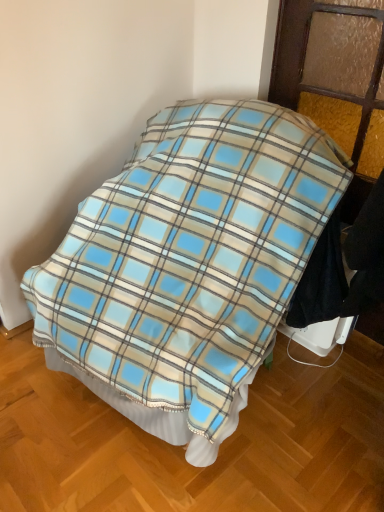
The width and height of the screenshot is (384, 512). I want to click on blue plaid blanket at center, so click(x=188, y=265).

The width and height of the screenshot is (384, 512). What do you see at coordinates (188, 265) in the screenshot?
I see `blue plaid blanket at center` at bounding box center [188, 265].

Identify the location of blue plaid blanket at center. (188, 265).